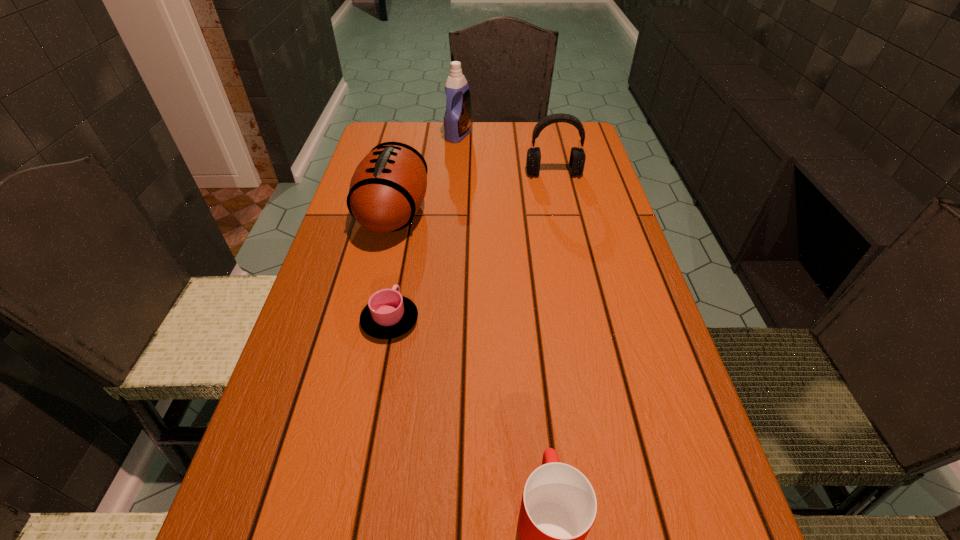
The width and height of the screenshot is (960, 540). I want to click on vacant space that satisfies the following two spatial constraints: 1. on the side with the handle of the fourth farthest object; 2. on the right side of the farthest object, so click(x=424, y=136).

You are a GUI agent. You are given a task and a screenshot of the screen. Output one action in this format:
    pyautogui.click(x=<x>, y=<y>)
    Task: Click on the free location that satisfies the following two spatial constraints: 1. on the back side of the detergent; 2. on the right side of the third nearest object
    
    Given the screenshot: What is the action you would take?
    pyautogui.click(x=412, y=136)

Find the location of `free location that satisfies the following two spatial constraints: 1. on the side with the handle of the third object from left to right; 2. on the left side of the shorter cup`. free location that satisfies the following two spatial constraints: 1. on the side with the handle of the third object from left to right; 2. on the left side of the shorter cup is located at coordinates (424, 136).